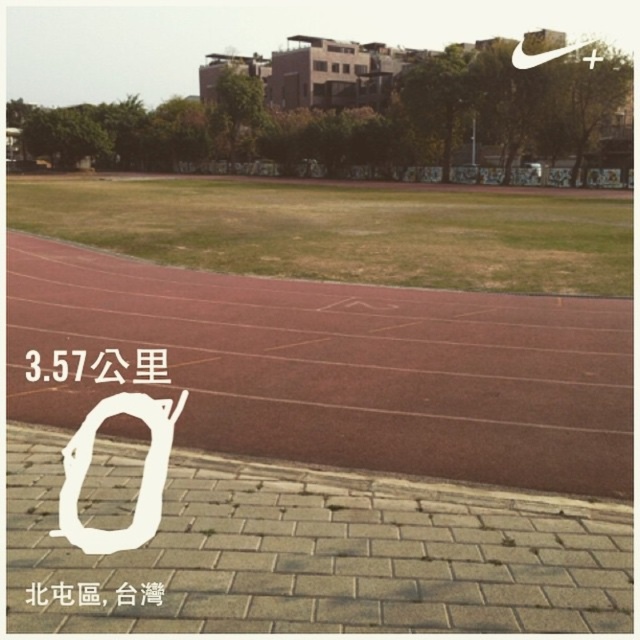
You are a delivery person who needs to place a large package on the ground. The package is too heavy to lift, so you must choose between placing it on the rubberized red track at center or the black paper at center. Based on the surface stability, which location would be more suitable for placing the heavy package?

The rubberized red track at center is wider than the black paper at center, making it a more stable surface for placing the heavy package.

You are an athlete preparing for a sprint. You see the rubberized red track at center and the black paper at center. Which surface would provide better traction for your running shoes? Explain your reasoning based on the scene description.

The rubberized red track at center is larger in size than the black paper at center, but traction depends on material. The track is made of a synthetic material designed for athletic use, which typically offers better grip and shock absorption compared to a black paper surface. However, the black paper at center might not be a suitable running surface as it could be slippery or unstable. The scene describes the track as smooth and well maintained, making it ideal for traction during sprints.

You are standing at the edge of the rubberized red track at center and the black paper at center. Which object is nearer to you?

The rubberized red track at center is closer to the viewer than the black paper at center.